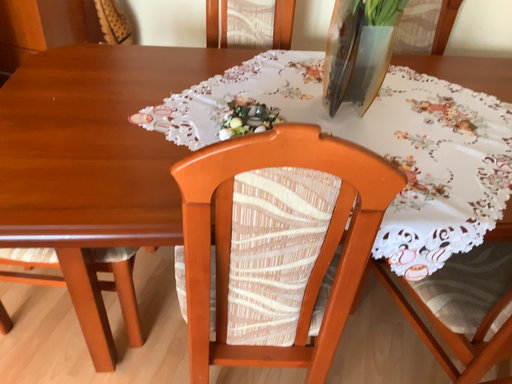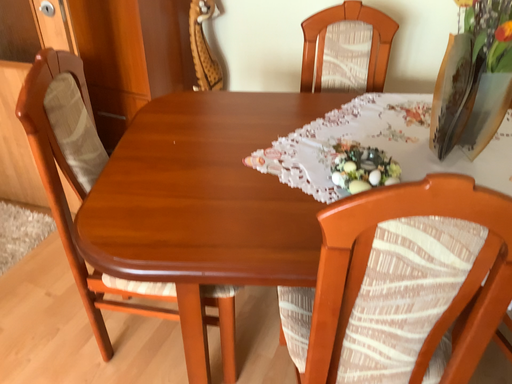
Question: Which way did the camera rotate in the video?

Choices:
 (A) rotated right
 (B) rotated left

Answer: (B)